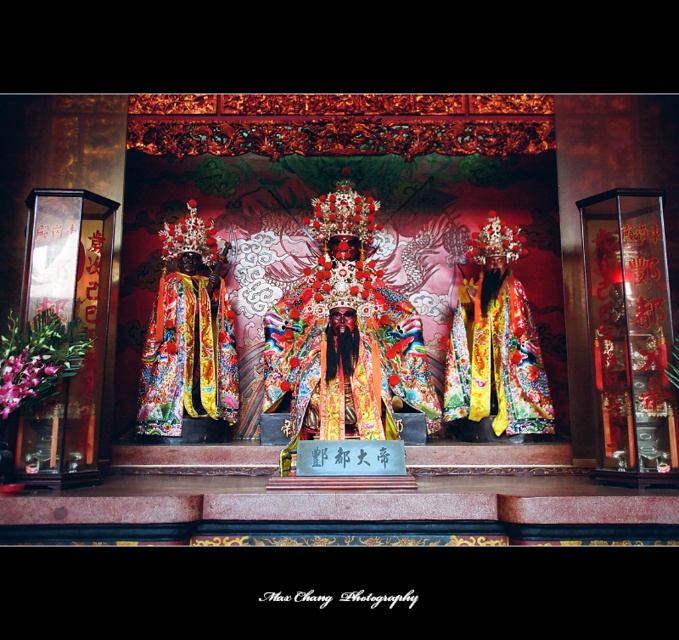
Can you confirm if matte gold costume at center is positioned below silky brocade robe at center?

No, matte gold costume at center is not below silky brocade robe at center.

Can you confirm if matte gold costume at center is positioned above silky brocade robe at center?

Yes.

Between point (335, 252) and point (172, 422), which one is positioned in front?

Point (172, 422) is in front.

Locate an element on the screen. matte gold costume at center is located at coordinates (344, 336).

Does point (361, 310) come farther from viewer compared to point (515, 227)?

No, it is not.

Is matte gold costume at center thinner than shiny red flower at center?

Incorrect, matte gold costume at center's width is not less than shiny red flower at center's.

Image resolution: width=679 pixels, height=640 pixels. What do you see at coordinates (344, 336) in the screenshot? I see `matte gold costume at center` at bounding box center [344, 336].

Locate an element on the screen. matte gold costume at center is located at coordinates (344, 336).

Does silky brocade robe at center have a greater height compared to pink silk flower at lower left?

Yes.

You are a GUI agent. You are given a task and a screenshot of the screen. Output one action in this format:
    pyautogui.click(x=<x>, y=<y>)
    Task: Click on the silky brocade robe at center
    The image size is (679, 640).
    Given the screenshot: What is the action you would take?
    pyautogui.click(x=187, y=355)